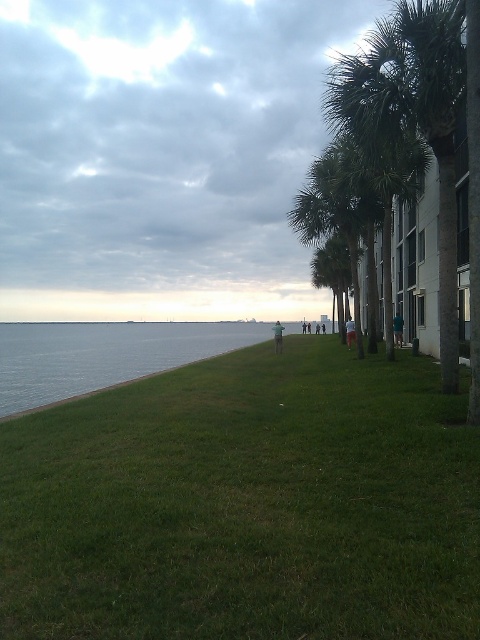
You are standing at the center of the scene and want to reach the blue water at lower left. Which direction should you face to walk directly towards it?

To reach the blue water at lower left, you should face towards the lower left direction since it is located at point [104,355].